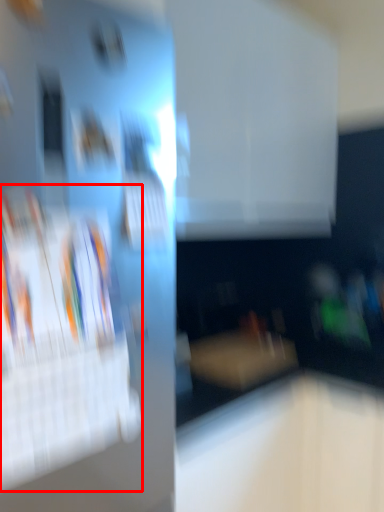
Question: Considering the relative positions of magazine (annotated by the red box) and furniture in the image provided, where is magazine (annotated by the red box) located with respect to the staircase?

Choices:
 (A) right
 (B) left

Answer: (B)